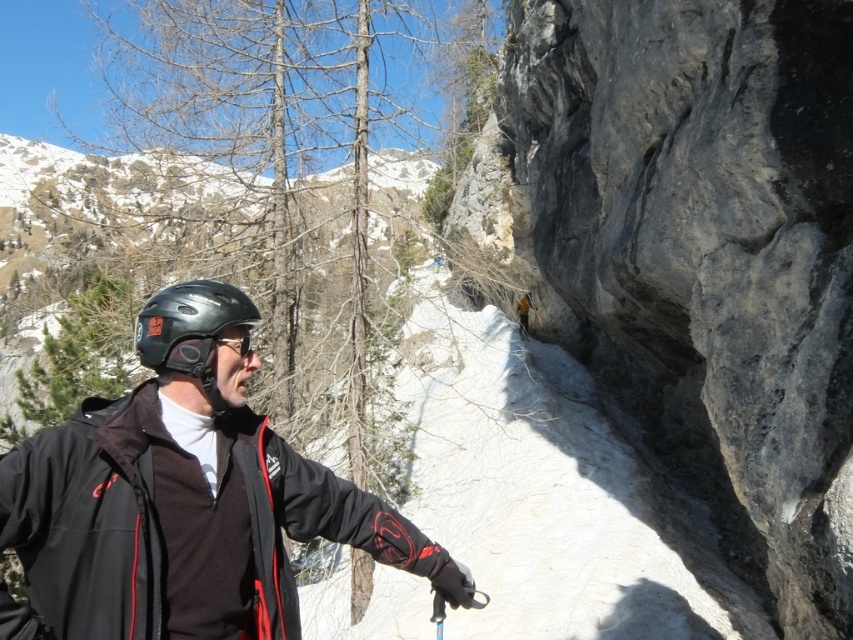
Looking at this image, does matte black helmet at left come in front of black matte goggles at center?

Yes, matte black helmet at left is in front of black matte goggles at center.

Does matte black helmet at left have a smaller size compared to black matte goggles at center?

Incorrect, matte black helmet at left is not smaller in size than black matte goggles at center.

Describe the element at coordinates (190, 326) in the screenshot. This screenshot has height=640, width=853. I see `matte black helmet at left` at that location.

The image size is (853, 640). I want to click on matte black helmet at left, so click(190, 326).

Who is positioned more to the left, black softshell jacket at left or matte black helmet at left?

Positioned to the left is matte black helmet at left.

Does black softshell jacket at left come in front of matte black helmet at left?

Yes, it is.

Identify the location of black softshell jacket at left. The width and height of the screenshot is (853, 640). (177, 529).

Find the location of a particular element. This screenshot has height=640, width=853. black softshell jacket at left is located at coordinates pos(177,529).

Does white powdery snow at center have a greater width compared to matte black goggles at center?

Yes.

At what (x,y) coordinates should I click in order to perform the action: click on white powdery snow at center. Please return your answer as a coordinate pair (x, y). Looking at the image, I should click on (550, 492).

Locate an element on the screen. white powdery snow at center is located at coordinates (550, 492).